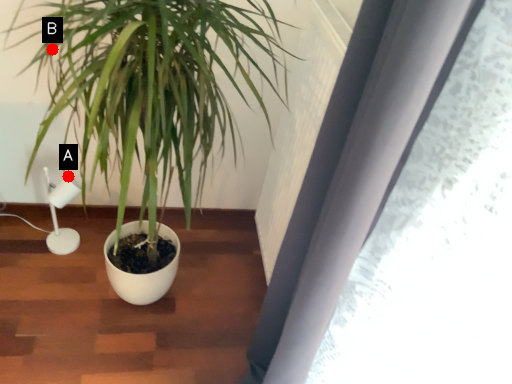
Question: Two points are circled on the image, labeled by A and B beside each circle. Which point is closer to the camera?

Choices:
 (A) A is closer
 (B) B is closer

Answer: (B)